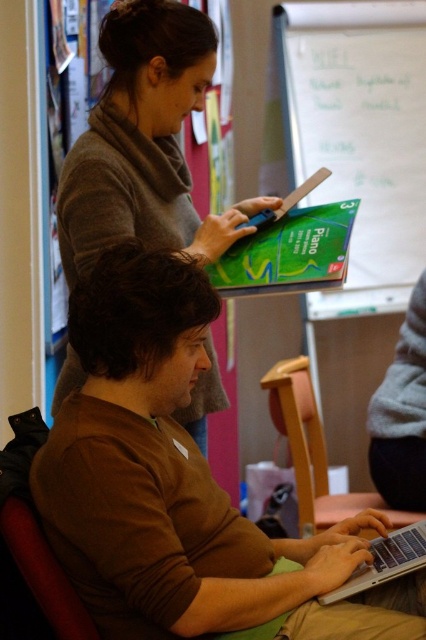
Find the location of a particular element. The width and height of the screenshot is (426, 640). green cardboard box at upper center is located at coordinates (359, 136).

Does green cardboard box at upper center appear under wooden chair at lower center?

Actually, green cardboard box at upper center is above wooden chair at lower center.

Is point (313, 132) closer to camera compared to point (321, 451)?

No, (313, 132) is behind (321, 451).

Locate an element on the screen. This screenshot has width=426, height=640. green cardboard box at upper center is located at coordinates (359, 136).

Is green cardboard box at upper center bigger than matte gray sweater at upper left?

Yes.

Between green cardboard box at upper center and matte gray sweater at upper left, which one has less height?

matte gray sweater at upper left

Which is in front, point (365, 310) or point (138, 13)?

Point (138, 13) is in front.

Where is `green cardboard box at upper center`? green cardboard box at upper center is located at coordinates (359, 136).

Is brown matte shirt at center to the left of wooden chair at lower center from the viewer's perspective?

Yes, brown matte shirt at center is to the left of wooden chair at lower center.

Can you confirm if brown matte shirt at center is taller than wooden chair at lower center?

Indeed, brown matte shirt at center has a greater height compared to wooden chair at lower center.

Is point (344, 529) behind point (308, 381)?

No.

The image size is (426, 640). I want to click on brown matte shirt at center, so click(x=178, y=484).